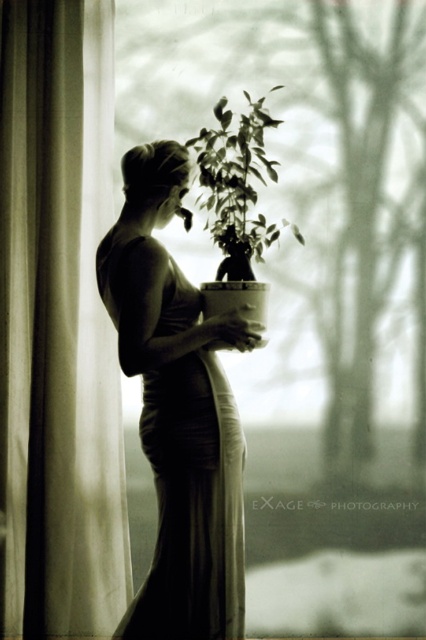
Can you confirm if matte white dress at center is positioned above green matte plant at center?

Actually, matte white dress at center is below green matte plant at center.

Can you confirm if matte white dress at center is shorter than green matte plant at center?

In fact, matte white dress at center may be taller than green matte plant at center.

Does point (169, 403) come in front of point (244, 145)?

That is True.

Locate an element on the screen. This screenshot has width=426, height=640. matte white dress at center is located at coordinates (178, 410).

Who is more distant from viewer, (x=80, y=1) or (x=195, y=336)?

The point (x=80, y=1) is behind.

Where is `white sheer curtain at left`? The image size is (426, 640). white sheer curtain at left is located at coordinates (57, 326).

Which is behind, point (77, 403) or point (219, 205)?

The point (77, 403) is more distant.

Does white sheer curtain at left appear on the right side of green matte plant at center?

In fact, white sheer curtain at left is to the left of green matte plant at center.

Where is `white sheer curtain at left`? Image resolution: width=426 pixels, height=640 pixels. white sheer curtain at left is located at coordinates (57, 326).